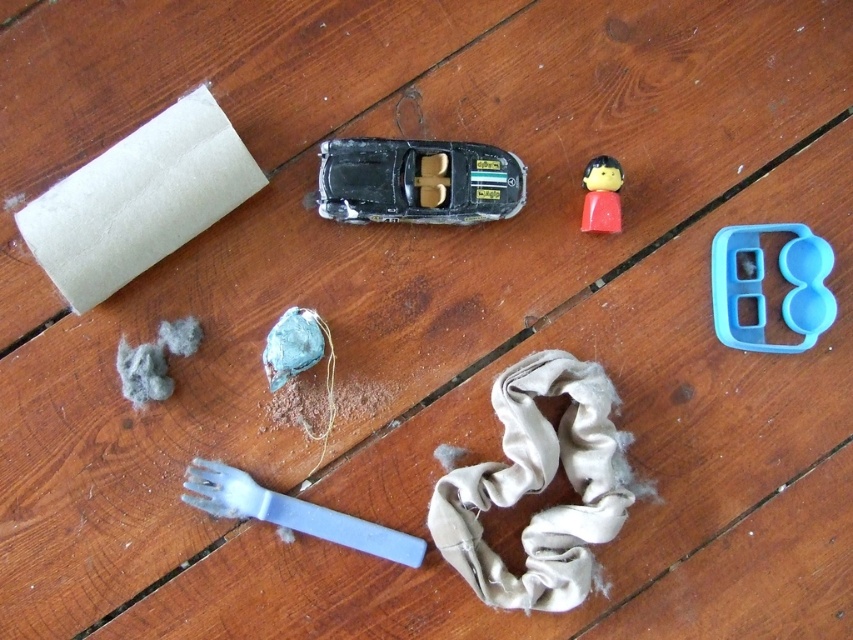
Based on the photo, you are organizing items on a wooden table. You have a beige fabric at center and a blue plastic fork at lower left. Which item is positioned to the right of the other?

The beige fabric at center is positioned to the right of the blue plastic fork at lower left.

You are a child playing on the wooden surface. You want to grab the blue plastic fork at lower left but there is a black plastic toy car at center in the way. Can you reach the fork without moving the car?

The black plastic toy car at center is further to the viewer than blue plastic fork at lower left, so the car is closer to you. This means the car is blocking your direct path to the fork, so you cannot reach the fork without moving the car.